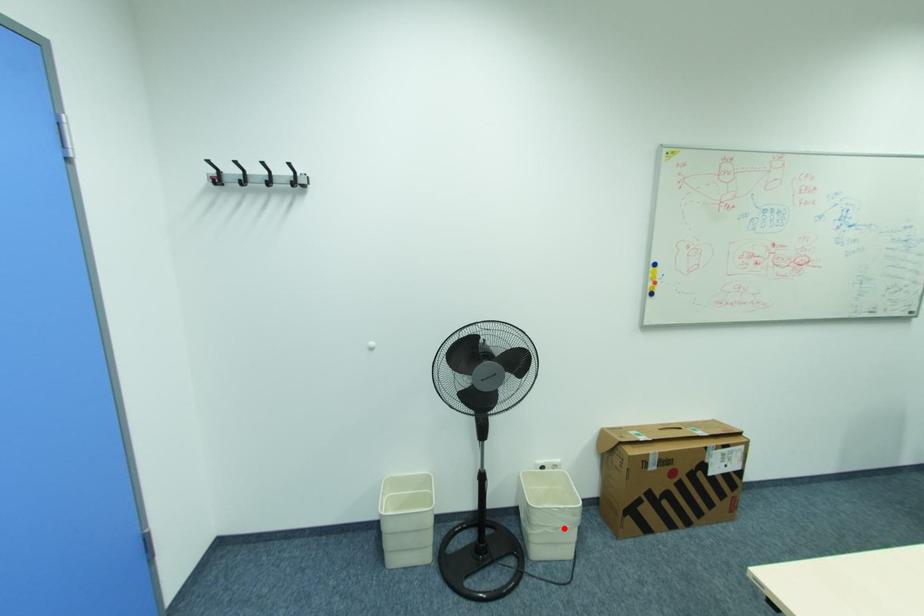
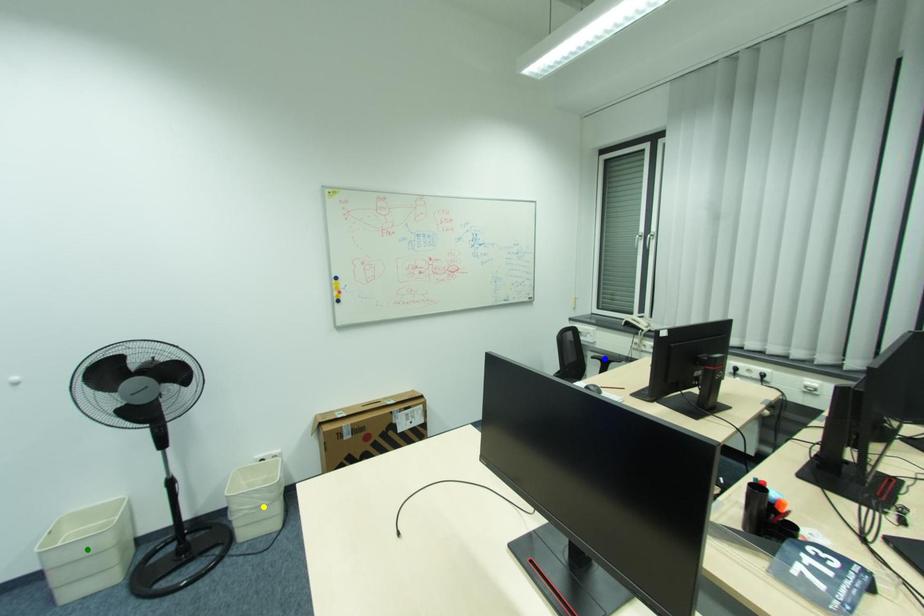
Question: I am providing you with two images of the same scene from different viewpoints. A red point is marked on the first image. You are given multiple points on the second image. Which point in image 2 is actually the same real-world point as the red point in image 1?

Choices:
 (A) green point
 (B) yellow point
 (C) blue point

Answer: (B)